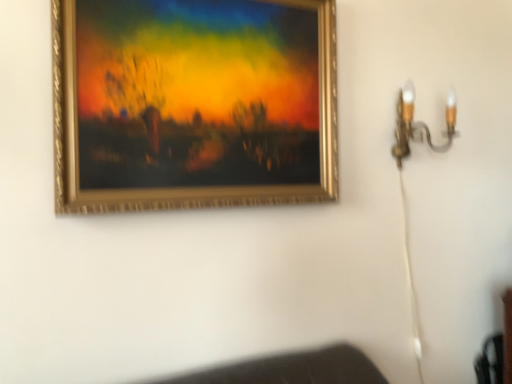
Question: Is gold metallic wall sconce at upper right further to the viewer compared to gold-framed painting at upper center?

Choices:
 (A) no
 (B) yes

Answer: (B)

Question: Is gold metallic wall sconce at upper right positioned with its back to gold-framed painting at upper center?

Choices:
 (A) no
 (B) yes

Answer: (A)

Question: From the image's perspective, is gold metallic wall sconce at upper right on top of gold-framed painting at upper center?

Choices:
 (A) no
 (B) yes

Answer: (A)

Question: From the image's perspective, would you say gold metallic wall sconce at upper right is shown under gold-framed painting at upper center?

Choices:
 (A) no
 (B) yes

Answer: (B)

Question: From a real-world perspective, is gold metallic wall sconce at upper right on top of gold-framed painting at upper center?

Choices:
 (A) yes
 (B) no

Answer: (B)

Question: Is gold metallic wall sconce at upper right taller than gold-framed painting at upper center?

Choices:
 (A) no
 (B) yes

Answer: (A)

Question: Is gold-framed painting at upper center to the right of gold metallic wall sconce at upper right from the viewer's perspective?

Choices:
 (A) no
 (B) yes

Answer: (A)

Question: Is gold-framed painting at upper center taller than gold metallic wall sconce at upper right?

Choices:
 (A) yes
 (B) no

Answer: (A)

Question: Is gold-framed painting at upper center thinner than gold metallic wall sconce at upper right?

Choices:
 (A) yes
 (B) no

Answer: (A)

Question: Is gold-framed painting at upper center oriented away from gold metallic wall sconce at upper right?

Choices:
 (A) yes
 (B) no

Answer: (B)

Question: Considering the relative positions of gold-framed painting at upper center and gold metallic wall sconce at upper right in the image provided, is gold-framed painting at upper center to the left of gold metallic wall sconce at upper right from the viewer's perspective?

Choices:
 (A) no
 (B) yes

Answer: (B)

Question: Is gold metallic wall sconce at upper right a part of gold-framed painting at upper center?

Choices:
 (A) yes
 (B) no

Answer: (B)

Question: In terms of size, does gold metallic wall sconce at upper right appear bigger or smaller than gold-framed painting at upper center?

Choices:
 (A) small
 (B) big

Answer: (A)